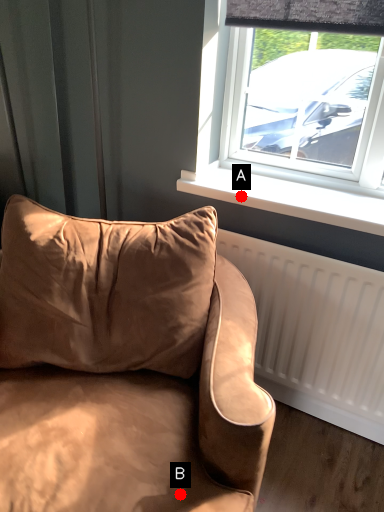
Question: Two points are circled on the image, labeled by A and B beside each circle. Which point appears farthest from the camera in this image?

Choices:
 (A) A is further
 (B) B is further

Answer: (A)